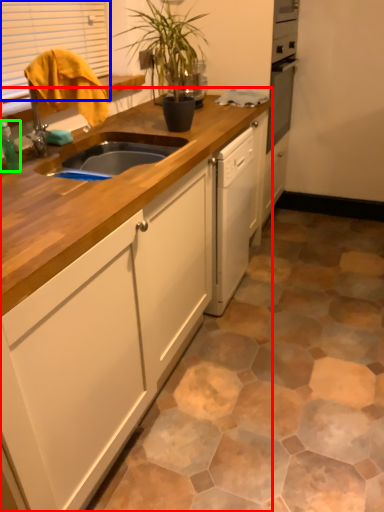
Question: Estimate the real-world distances between objects in this image. Which object is farther from cabinetry (highlighted by a red box), window (highlighted by a blue box) or bottle (highlighted by a green box)?

Choices:
 (A) window
 (B) bottle

Answer: (A)